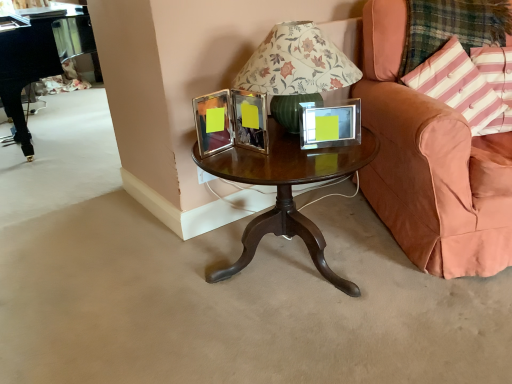
Question: From a real-world perspective, is pink striped fabric pillow at right, arranged as the 2th pillow when viewed from the left, positioned under peach velvet chair at right based on gravity?

Choices:
 (A) yes
 (B) no

Answer: (B)

Question: Does pink striped fabric pillow at right, arranged as the 2th pillow when viewed from the left, turn towards peach velvet chair at right?

Choices:
 (A) yes
 (B) no

Answer: (A)

Question: Is pink striped fabric pillow at right, which is counted as the first pillow, starting from the right, surrounding peach velvet chair at right?

Choices:
 (A) yes
 (B) no

Answer: (B)

Question: Is the surface of pink striped fabric pillow at right, which is counted as the first pillow, starting from the right, in direct contact with peach velvet chair at right?

Choices:
 (A) no
 (B) yes

Answer: (A)

Question: Is pink striped fabric pillow at right, which is counted as the first pillow, starting from the right, positioned beyond the bounds of peach velvet chair at right?

Choices:
 (A) yes
 (B) no

Answer: (B)

Question: From a real-world perspective, is clear glass picture frame at center positioned above or below pink striped fabric pillow at upper right, the second pillow from the right?

Choices:
 (A) below
 (B) above

Answer: (B)

Question: In terms of width, does clear glass picture frame at center look wider or thinner when compared to pink striped fabric pillow at upper right, the second pillow from the right?

Choices:
 (A) wide
 (B) thin

Answer: (B)

Question: Is point (306, 130) closer or farther from the camera than point (470, 96)?

Choices:
 (A) closer
 (B) farther

Answer: (A)

Question: Based on their positions, is clear glass picture frame at center located to the left or right of pink striped fabric pillow at upper right, the first pillow from the left?

Choices:
 (A) right
 (B) left

Answer: (B)

Question: From the image's perspective, is clear glass picture frame at center positioned above or below mahogany wood coffee table at center?

Choices:
 (A) above
 (B) below

Answer: (A)

Question: From a real-world perspective, is clear glass picture frame at center positioned above or below mahogany wood coffee table at center?

Choices:
 (A) above
 (B) below

Answer: (A)

Question: Is point [x=342, y=102] closer or farther from the camera than point [x=317, y=165]?

Choices:
 (A) closer
 (B) farther

Answer: (B)

Question: Considering their positions, is clear glass picture frame at center located in front of or behind mahogany wood coffee table at center?

Choices:
 (A) front
 (B) behind

Answer: (B)

Question: In terms of width, does clear glass picture frame at center look wider or thinner when compared to plaid fabric at right?

Choices:
 (A) thin
 (B) wide

Answer: (A)

Question: Relative to plaid fabric at right, is clear glass picture frame at center in front or behind?

Choices:
 (A) front
 (B) behind

Answer: (A)